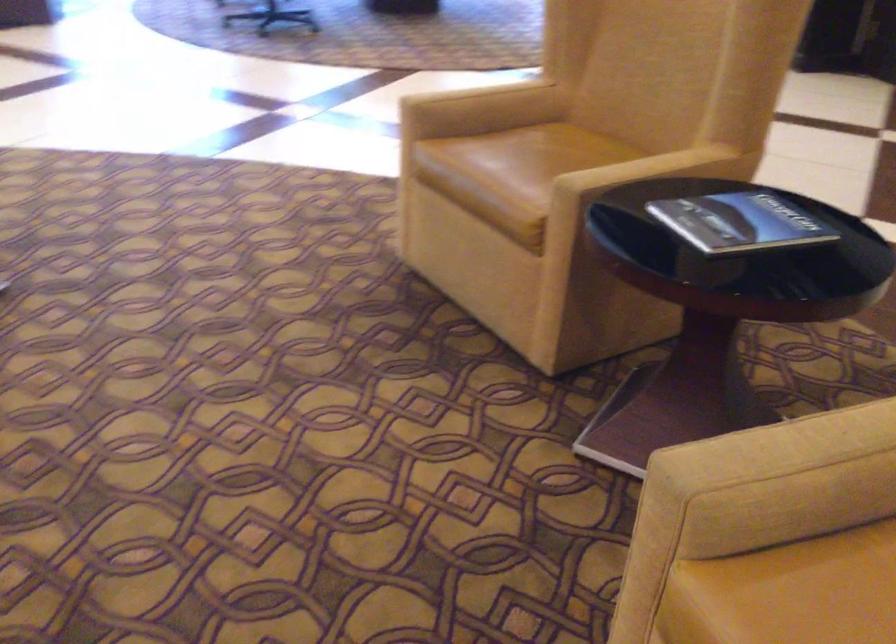
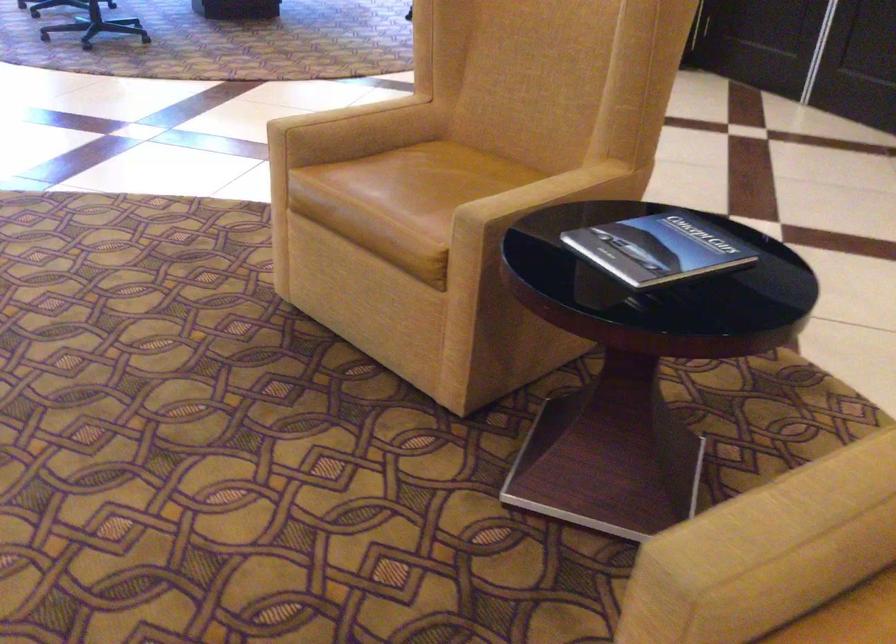
In the second image, find the point that corresponds to pixel 771 462 in the first image.

(778, 543)